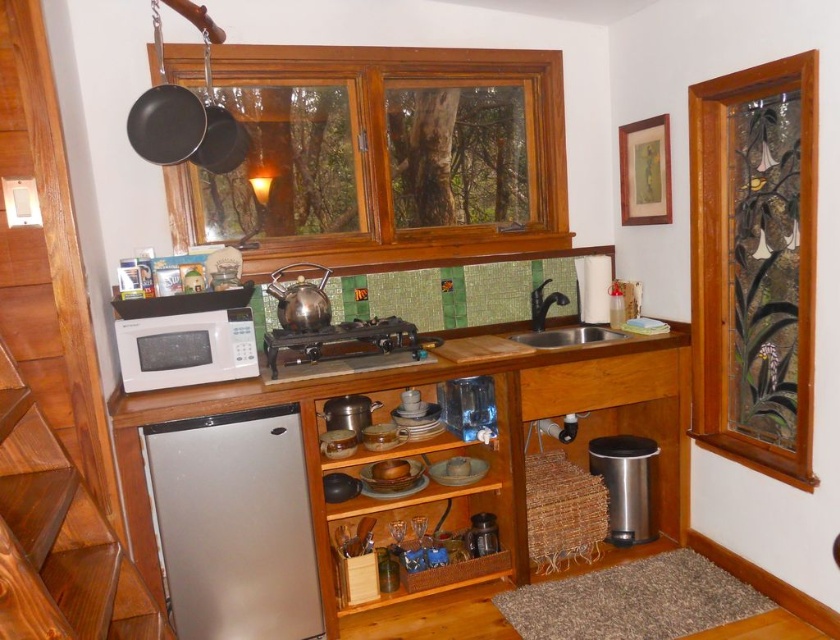
Does white matte microwave at left have a lesser height compared to satin silver sink at center?

No, white matte microwave at left is not shorter than satin silver sink at center.

Does white matte microwave at left appear over satin silver sink at center?

No, white matte microwave at left is not above satin silver sink at center.

Which is in front, point (675, 480) or point (515, 339)?

Positioned in front is point (675, 480).

Locate an element on the screen. The height and width of the screenshot is (640, 840). white matte microwave at left is located at coordinates coord(441,456).

Is point (138, 476) in front of point (623, 540)?

That is True.

Does point (518, 464) lie behind point (623, 480)?

No.

Is point (499, 358) farther from viewer compared to point (633, 524)?

No, (499, 358) is in front of (633, 524).

The image size is (840, 640). Find the location of `white matte microwave at left`. white matte microwave at left is located at coordinates (441, 456).

Between stained glass window at right and black cast iron stove at center, which one appears on the left side from the viewer's perspective?

From the viewer's perspective, black cast iron stove at center appears more on the left side.

Between stained glass window at right and black cast iron stove at center, which one appears on the right side from the viewer's perspective?

Positioned to the right is stained glass window at right.

Does point (709, 193) come in front of point (412, 356)?

No.

Locate an element on the screen. stained glass window at right is located at coordinates (754, 264).